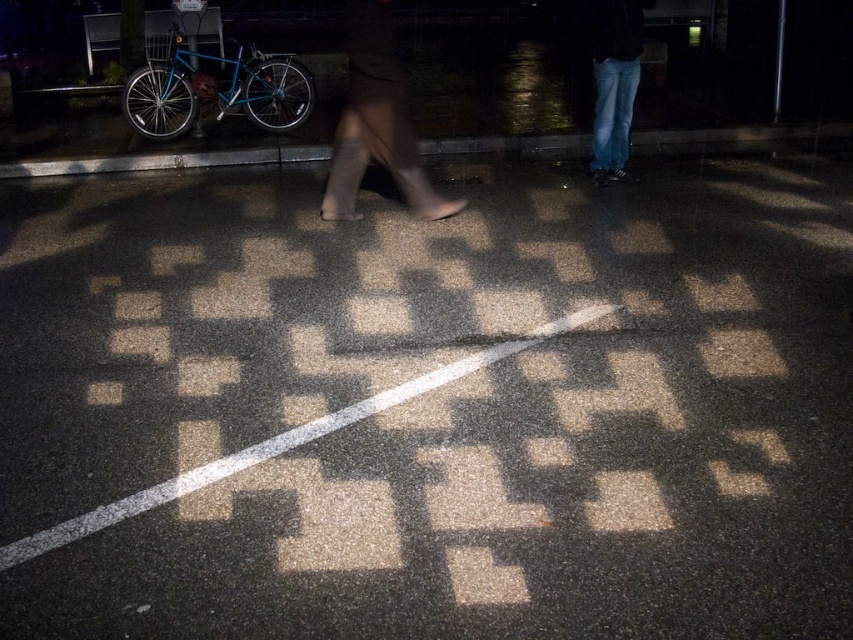
Question: Which object appears closest to the camera in this image?

Choices:
 (A) jeans at upper right
 (B) leather boots at center

Answer: (B)

Question: Is leather boots at center positioned in front of jeans at upper right?

Choices:
 (A) yes
 (B) no

Answer: (A)

Question: Does leather boots at center have a smaller size compared to jeans at upper right?

Choices:
 (A) yes
 (B) no

Answer: (B)

Question: Is leather boots at center to the left of jeans at upper right from the viewer's perspective?

Choices:
 (A) yes
 (B) no

Answer: (A)